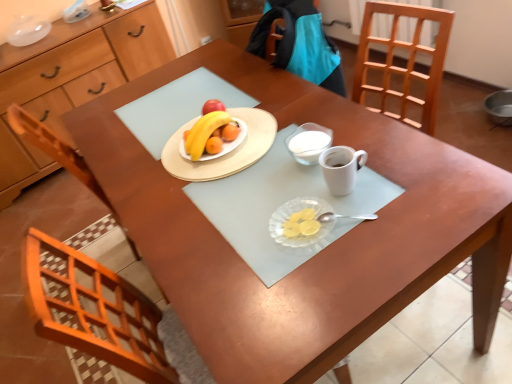
Where is `vacant space behind white matte coffee cup at center`? Image resolution: width=512 pixels, height=384 pixels. vacant space behind white matte coffee cup at center is located at coordinates (332, 140).